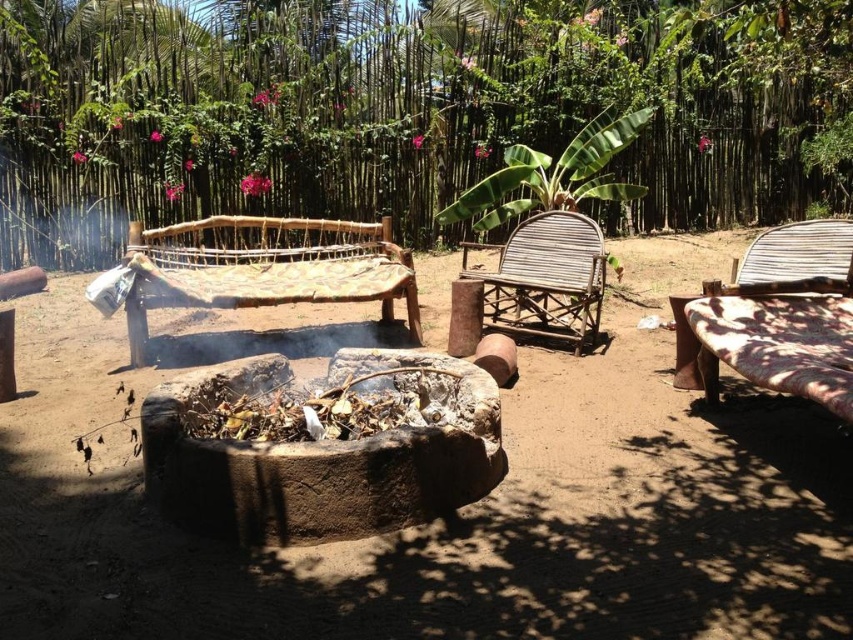
Question: Observing the image, what is the correct spatial positioning of brown bamboo forest at upper center in reference to woven bamboo chair at center?

Choices:
 (A) above
 (B) below

Answer: (A)

Question: Estimate the real-world distances between objects in this image. Which object is closer to the natural wood woven chair at center?

Choices:
 (A) dull brown dirt at center
 (B) woven bamboo chair at center
 (C) woven bamboo chair at right

Answer: (B)

Question: Does natural wood woven chair at center have a smaller size compared to woven bamboo chair at center?

Choices:
 (A) yes
 (B) no

Answer: (B)

Question: Considering the real-world distances, which object is closest to the woven bamboo chair at center?

Choices:
 (A) brown bamboo forest at upper center
 (B) earthy stone fire pit at center
 (C) natural wood woven chair at center
 (D) dull brown dirt at center

Answer: (C)

Question: Does natural wood woven chair at center appear over woven bamboo chair at center?

Choices:
 (A) yes
 (B) no

Answer: (A)

Question: Estimate the real-world distances between objects in this image. Which object is farther from the earthy stone fire pit at center?

Choices:
 (A) woven bamboo chair at right
 (B) natural wood woven chair at center
 (C) brown bamboo forest at upper center
 (D) woven bamboo chair at center

Answer: (C)